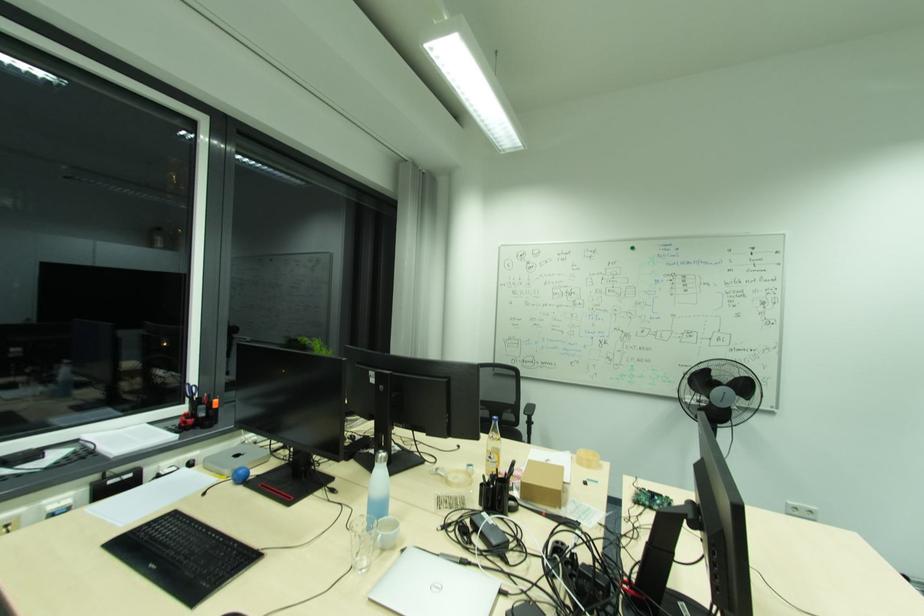
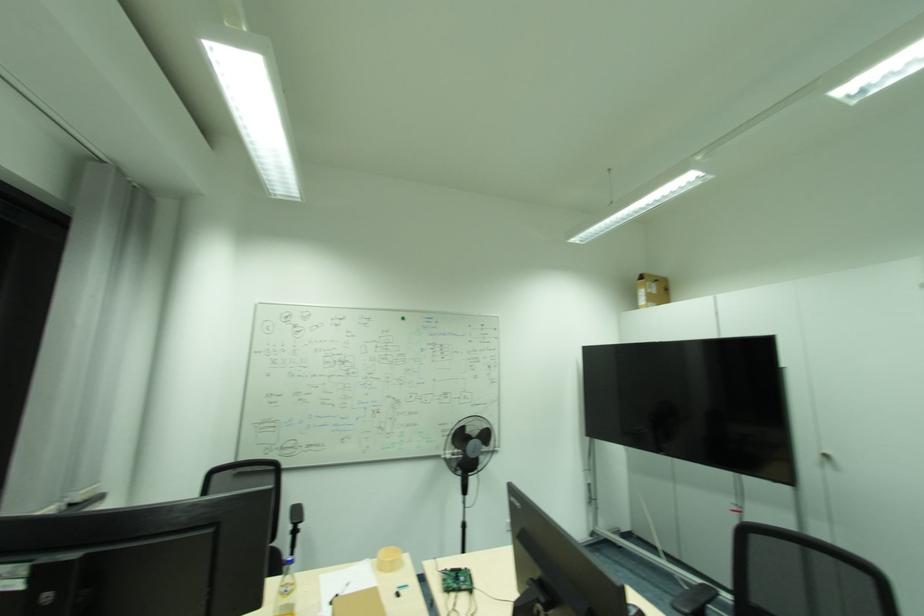
In the second image, find the point that corresponds to point 586,453 in the first image.

(386, 553)